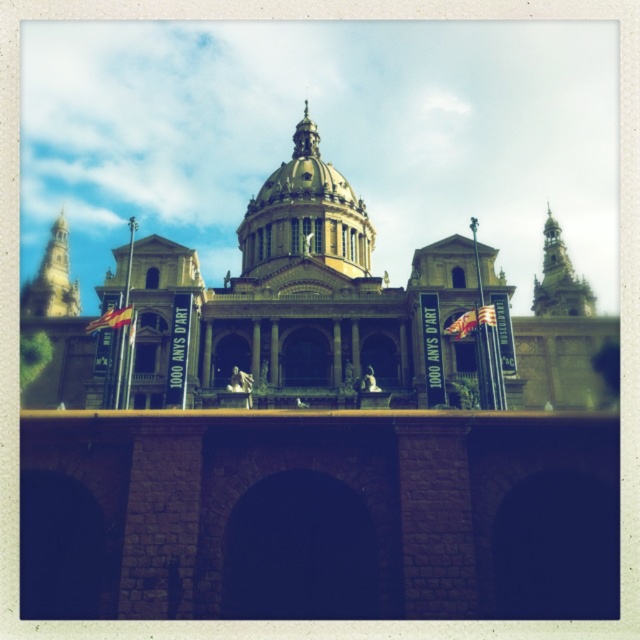
You are an architect examining the building. You notice two towers, the gold stone tower at upper right and the golden stone tower at upper left. Which tower appears smaller in size?

The gold stone tower at upper right appears smaller in size compared to the golden stone tower at upper left according to the description.

You are standing in front of the grand building and notice two towers. One is the gold stone tower at upper right and the other is the golden stone tower at upper left. From your perspective, which tower is located to the right side?

The gold stone tower at upper right is located to the right of the golden stone tower at upper left.

From the picture: You are an architect visiting this building and want to determine the spatial relationship between the gold textured dome at center and the golden stone tower at upper left. Based on the scene, which object is closer to the viewer?

The gold textured dome at center is closer to the viewer because it is in front of the golden stone tower at upper left.